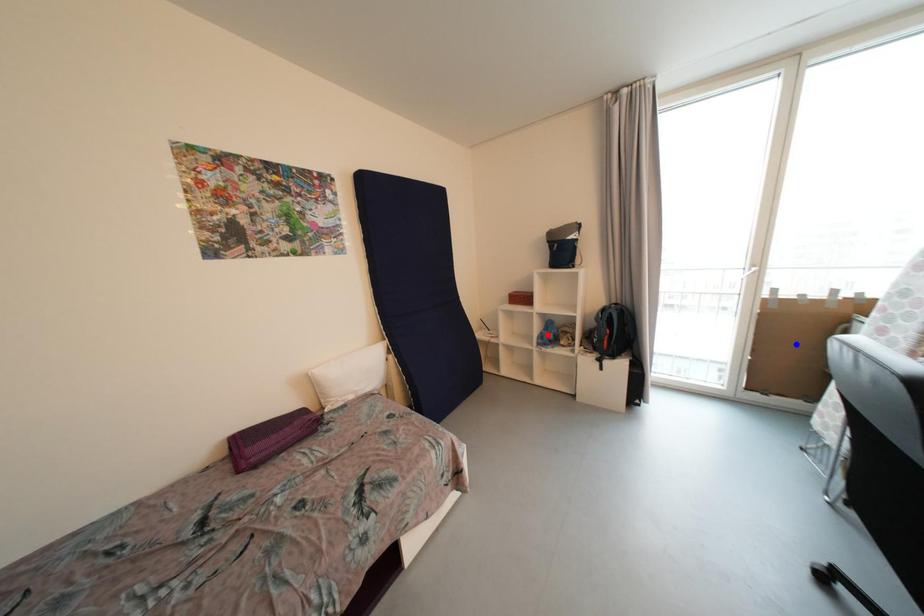
Question: In the image, two points are highlighted. Which point is nearer to the camera? Reply with the corresponding letter.

Choices:
 (A) blue point
 (B) red point

Answer: (A)